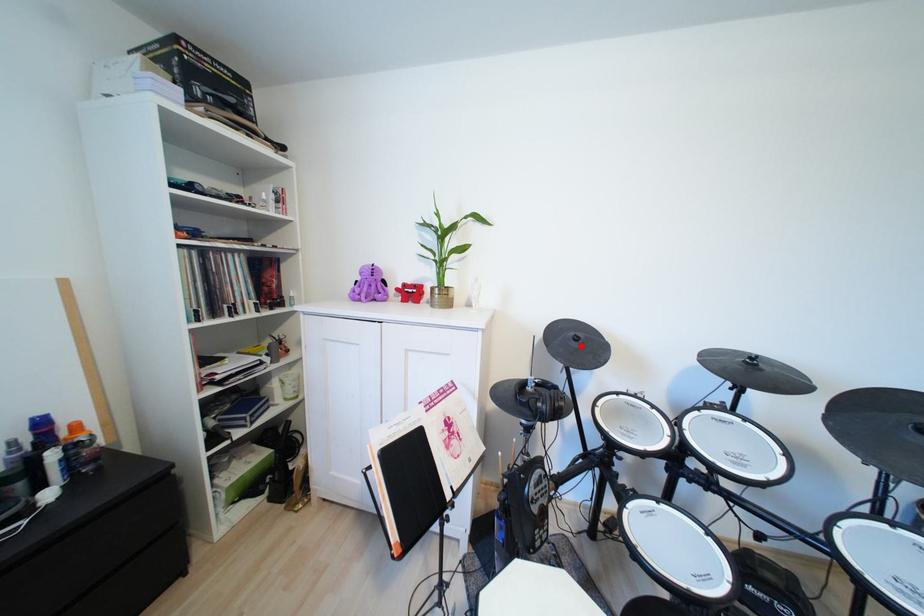
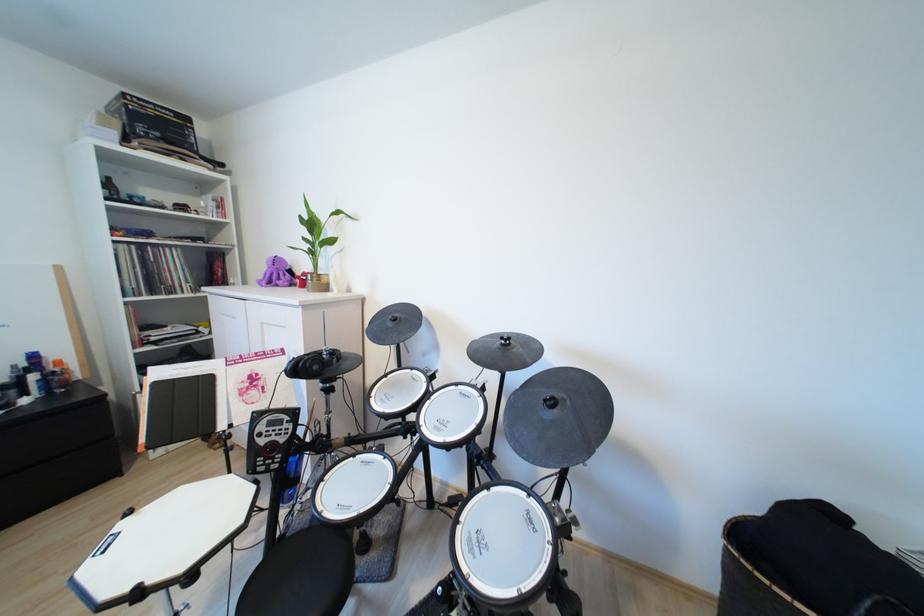
Find the pixel in the second image that matches the highlighted location in the first image.

(396, 325)